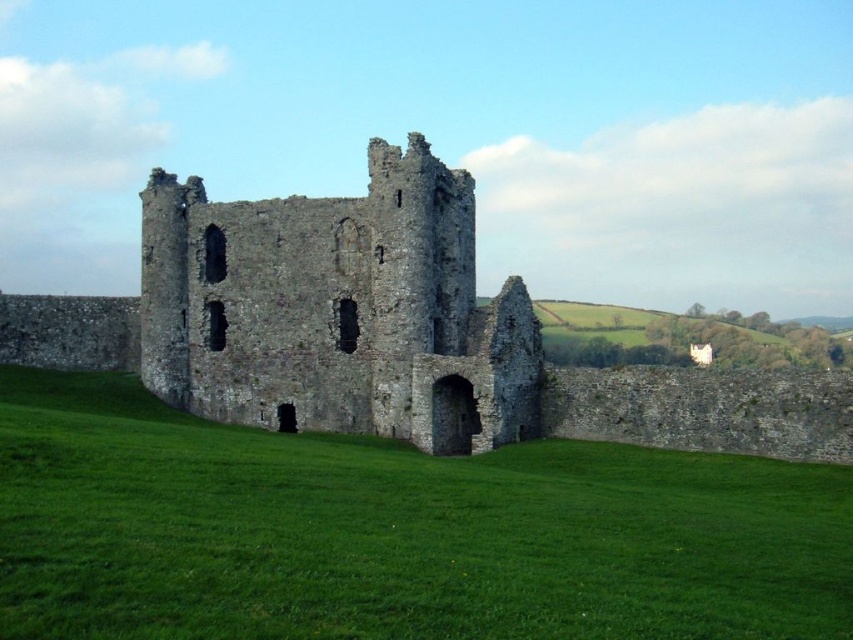
You are a tourist visiting the medieval ruins and want to take a photo that includes both the green grassy at center and the stone castle at center. Which object should you focus on first to ensure both are in frame?

Since the green grassy at center is smaller than the stone castle at center, you should focus on the stone castle at center first to ensure both fit within the frame.

You are standing at the base of the medieval ruins and want to take a photo that includes both the central tower and the well in the foreground. Which point, point (456, 561) or point (195, 236), should you position yourself closer to ensure both elements are in focus?

You should position yourself closer to point (456, 561) because it is closer to the camera, ensuring both the central tower and the well are within the focal range.

You are standing on the hilltop and want to reach the stone castle at center. Which direction should you move relative to the green grassy at center to get there?

The stone castle at center is above the green grassy at center, so you should move upward from the green grassy at center to reach the stone castle at center.